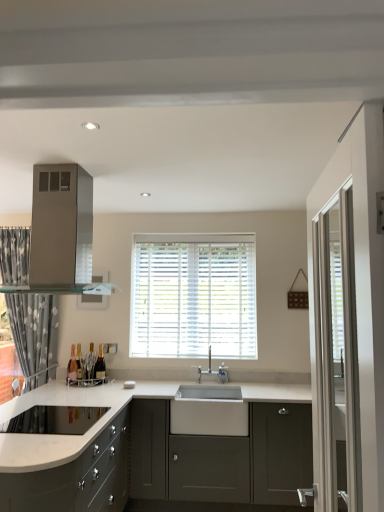
This screenshot has height=512, width=384. What are the coordinates of `vacant space in front of silver metallic faucet at center` in the screenshot? It's located at (217, 385).